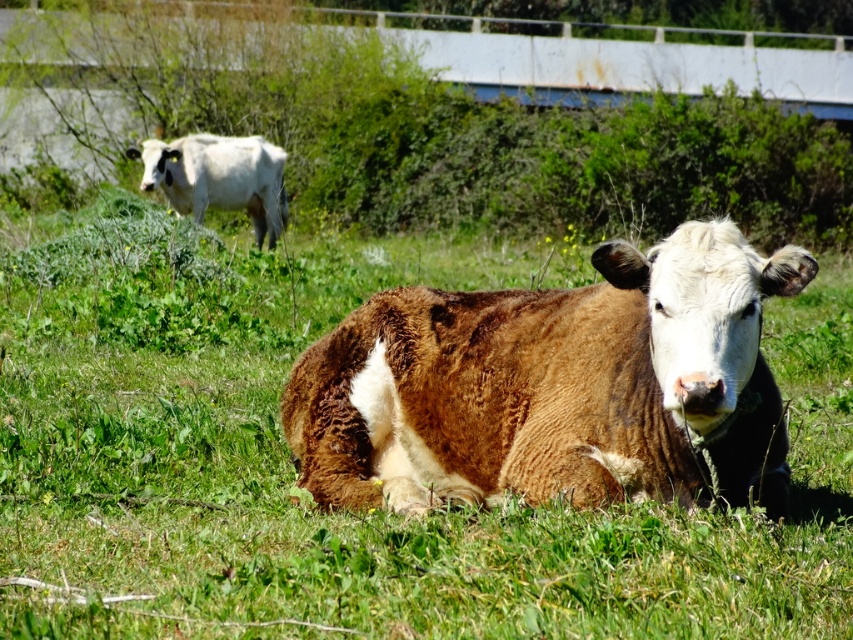
Is point (463, 486) behind point (172, 189)?

No, (463, 486) is in front of (172, 189).

At what (x,y) coordinates should I click in order to perform the action: click on brown furry cow at center. Please return your answer as a coordinate pair (x, y). The height and width of the screenshot is (640, 853). Looking at the image, I should click on tap(554, 385).

Which of these two, green grassy at center or white smooth cow at upper left, stands shorter?

Standing shorter between the two is white smooth cow at upper left.

What do you see at coordinates (346, 513) in the screenshot? The height and width of the screenshot is (640, 853). I see `green grassy at center` at bounding box center [346, 513].

What do you see at coordinates (346, 513) in the screenshot?
I see `green grassy at center` at bounding box center [346, 513].

Locate an element on the screen. green grassy at center is located at coordinates (346, 513).

Can you confirm if green grassy at center is wider than brown furry cow at center?

Yes.

Between point (7, 451) and point (390, 320), which one is positioned in front?

Positioned in front is point (390, 320).

I want to click on green grassy at center, so click(x=346, y=513).